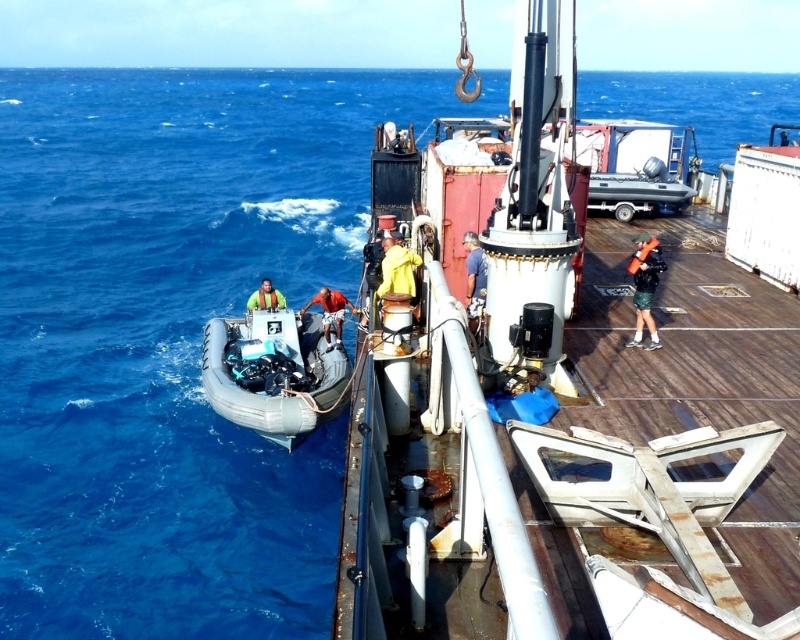
Which of these two, green fabric life vest at right or reddish-orange fabric at center, stands shorter?

With less height is reddish-orange fabric at center.

Does green fabric life vest at right have a smaller size compared to reddish-orange fabric at center?

No, green fabric life vest at right is not smaller than reddish-orange fabric at center.

Describe the element at coordinates (644, 285) in the screenshot. I see `green fabric life vest at right` at that location.

Find the location of a particular element. The height and width of the screenshot is (640, 800). green fabric life vest at right is located at coordinates (644, 285).

Is green fabric life vest at right thinner than yellow life vest at center?

Yes.

Does green fabric life vest at right have a greater width compared to yellow life vest at center?

Incorrect, green fabric life vest at right's width does not surpass yellow life vest at center's.

Locate an element on the screen. The height and width of the screenshot is (640, 800). green fabric life vest at right is located at coordinates (644, 285).

Consider the image. Does rubberized gray dinghy at lower left have a lesser width compared to reddish-orange fabric at center?

Incorrect, rubberized gray dinghy at lower left's width is not less than reddish-orange fabric at center's.

Who is more distant from viewer, (300, 353) or (337, 316)?

Positioned behind is point (337, 316).

The width and height of the screenshot is (800, 640). I want to click on rubberized gray dinghy at lower left, so tap(274, 372).

Find the location of a particular element. This screenshot has width=800, height=640. rubberized gray dinghy at lower left is located at coordinates (274, 372).